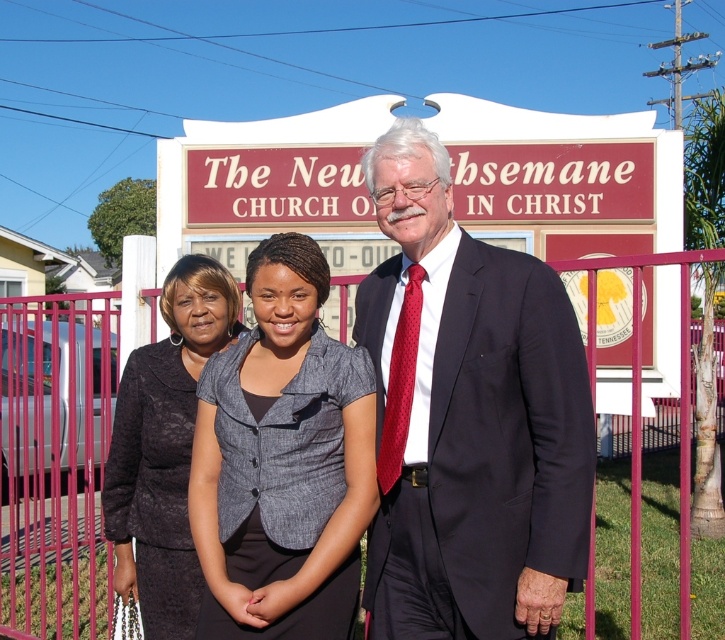
You are standing in front of the church sign and want to greet the person wearing the navy blue suit at center. Which direction should you move relative to the dark gray textured blazer at center?

The navy blue suit at center is to the right of the dark gray textured blazer at center, so you should move to the right of the dark gray textured blazer at center to greet the person in the navy blue suit at center.

You are a photographer trying to capture a clear shot of the church sign. The navy blue suit at center and the gray textured blazer at center are blocking part of the sign. Which clothing item should you ask to move to ensure the sign is fully visible?

The navy blue suit at center is taller than the gray textured blazer at center. To ensure the church sign is fully visible, you should ask the person wearing the navy blue suit at center to move as it is taller and likely blocking more of the sign.